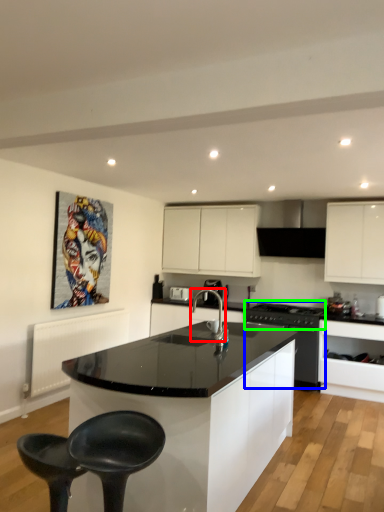
Question: Based on their relative distances, which object is nearer to tap (highlighted by a red box)? Choose from kitchen appliance (highlighted by a blue box) and stove (highlighted by a green box).

Choices:
 (A) kitchen appliance
 (B) stove

Answer: (B)